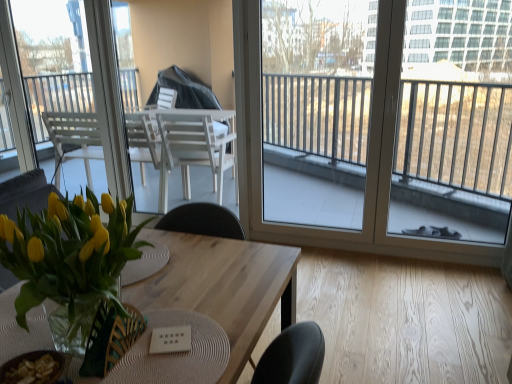
This screenshot has height=384, width=512. What are the coordinates of `translucent glass vase at lower left` in the screenshot? It's located at (72, 264).

The width and height of the screenshot is (512, 384). I want to click on green woven armchair at center, so click(110, 339).

What do you see at coordinates (110, 339) in the screenshot?
I see `green woven armchair at center` at bounding box center [110, 339].

The height and width of the screenshot is (384, 512). Identify the location of transparent glass window at center, which ranks as the first window in front-to-back order. (261, 117).

You are a GUI agent. You are given a task and a screenshot of the screen. Output one action in this format:
    pyautogui.click(x=<x>, y=<y>)
    Task: Click on the translucent glass vase at lower left
    This screenshot has width=512, height=384.
    Given the screenshot: What is the action you would take?
    pyautogui.click(x=72, y=264)

Does point (55, 105) come in front of point (71, 309)?

No, (55, 105) is behind (71, 309).

Is transparent glass window at upper left, marked as the 2th window in a right-to-left arrangement, wider or thinner than translucent glass vase at lower left?

In the image, transparent glass window at upper left, marked as the 2th window in a right-to-left arrangement, appears to be more narrow than translucent glass vase at lower left.

Is transparent glass window at upper left, which is the 1th window from back to front, positioned beyond the bounds of translucent glass vase at lower left?

transparent glass window at upper left, which is the 1th window from back to front, is positioned outside translucent glass vase at lower left.

Can you confirm if transparent glass window at upper left, which is the 1th window from left to right, is positioned to the right of translucent glass vase at lower left?

No.

From a real-world perspective, which object rests below the other?

green woven armchair at center is physically lower.

Consider the image. Is translucent glass vase at lower left next to green woven armchair at center?

No, translucent glass vase at lower left is not beside green woven armchair at center.

Can you confirm if translucent glass vase at lower left is positioned to the right of green woven armchair at center?

In fact, translucent glass vase at lower left is to the left of green woven armchair at center.

Is translucent glass vase at lower left further to the viewer compared to green woven armchair at center?

No, it is in front of green woven armchair at center.

From the picture: Can we say wooden table at center lies outside transparent glass window at upper left, which is the 1th window from back to front?

wooden table at center is positioned outside transparent glass window at upper left, which is the 1th window from back to front.

Considering the sizes of objects wooden table at center and transparent glass window at upper left, which is the 1th window from left to right, in the image provided, who is taller, wooden table at center or transparent glass window at upper left, which is the 1th window from left to right,?

transparent glass window at upper left, which is the 1th window from left to right.

Considering the positions of point (165, 291) and point (16, 4), is point (165, 291) closer or farther from the camera than point (16, 4)?

Clearly, point (165, 291) is closer to the camera than point (16, 4).

Considering the sizes of objects wooden table at center and transparent glass window at upper left, which is the 1th window from back to front, in the image provided, who is bigger, wooden table at center or transparent glass window at upper left, which is the 1th window from back to front,?

wooden table at center is bigger.

In the image, is transparent glass window at center, marked as the first window in a right-to-left arrangement, on the left side or the right side of transparent glass window at upper left, which is the 1th window from left to right?

transparent glass window at center, marked as the first window in a right-to-left arrangement, is to the right of transparent glass window at upper left, which is the 1th window from left to right.

From the picture: Is transparent glass window at center, the 2th window when ordered from left to right, positioned beyond the bounds of transparent glass window at upper left, which is the 1th window from back to front?

Yes, transparent glass window at center, the 2th window when ordered from left to right, is located beyond the bounds of transparent glass window at upper left, which is the 1th window from back to front.

Between transparent glass window at center, which ranks as the first window in front-to-back order, and transparent glass window at upper left, which ranks as the 2th window in front-to-back order, which one has less height?

transparent glass window at upper left, which ranks as the 2th window in front-to-back order.

Who is bigger, green woven armchair at center or wooden table at center?

Bigger between the two is wooden table at center.

Is green woven armchair at center positioned beyond the bounds of wooden table at center?

Absolutely, green woven armchair at center is external to wooden table at center.

Is point (132, 327) closer to camera compared to point (249, 326)?

Yes, point (132, 327) is in front of point (249, 326).

Is transparent glass window at center, which ranks as the first window in front-to-back order, placed right next to green woven armchair at center?

No, transparent glass window at center, which ranks as the first window in front-to-back order, is not with green woven armchair at center.

Is transparent glass window at center, the 2th window when ordered from left to right, taller than green woven armchair at center?

Yes, transparent glass window at center, the 2th window when ordered from left to right, is taller than green woven armchair at center.

How many degrees apart are the facing directions of transparent glass window at center, the 2th window when ordered from left to right, and green woven armchair at center?

transparent glass window at center, the 2th window when ordered from left to right, and green woven armchair at center are facing 90.7 degrees away from each other.

Which of these two, transparent glass window at center, which ranks as the first window in front-to-back order, or green woven armchair at center, is wider?

With larger width is green woven armchair at center.

Which of these two, transparent glass window at upper left, which is the 1th window from left to right, or green woven armchair at center, is thinner?

transparent glass window at upper left, which is the 1th window from left to right.

You are a GUI agent. You are given a task and a screenshot of the screen. Output one action in this format:
    pyautogui.click(x=<x>, y=<y>)
    Task: Click on the window on the left side of green woven armchair at center
    This screenshot has height=384, width=512.
    Given the screenshot: What is the action you would take?
    pyautogui.click(x=53, y=58)

Is transparent glass window at upper left, which ranks as the 2th window in front-to-back order, oriented towards green woven armchair at center?

No, transparent glass window at upper left, which ranks as the 2th window in front-to-back order, is not turned towards green woven armchair at center.

From the image's perspective, is transparent glass window at upper left, which is the 1th window from left to right, on top of green woven armchair at center?

Correct, transparent glass window at upper left, which is the 1th window from left to right, appears higher than green woven armchair at center in the image.

Locate an element on the screen. This screenshot has height=384, width=512. window that appears on the left of translucent glass vase at lower left is located at coordinates (53, 58).

Find the location of a particular element. The width and height of the screenshot is (512, 384). armchair below the translucent glass vase at lower left (from a real-world perspective) is located at coordinates (110, 339).

From the image, which object appears to be nearer to wooden table at center, translucent glass vase at lower left or green woven armchair at center?

translucent glass vase at lower left is closer to wooden table at center.

Which object lies further to the anchor point translucent glass vase at lower left, green woven armchair at center or transparent glass window at upper left, which ranks as the 2th window in front-to-back order?

Based on the image, transparent glass window at upper left, which ranks as the 2th window in front-to-back order, appears to be further to translucent glass vase at lower left.

Which object lies nearer to the anchor point transparent glass window at upper left, which is the 1th window from left to right, wooden table at center or green woven armchair at center?

wooden table at center lies closer to transparent glass window at upper left, which is the 1th window from left to right, than the other object.

Estimate the real-world distances between objects in this image. Which object is further from transparent glass window at center, which is counted as the 2th window, starting from the back, green woven armchair at center or translucent glass vase at lower left?

Among the two, green woven armchair at center is located further to transparent glass window at center, which is counted as the 2th window, starting from the back.

Looking at the image, which one is located further to transparent glass window at center, which is counted as the 2th window, starting from the back, translucent glass vase at lower left or transparent glass window at upper left, which is the 1th window from back to front?

translucent glass vase at lower left lies further to transparent glass window at center, which is counted as the 2th window, starting from the back, than the other object.

Looking at the image, which one is located further to green woven armchair at center, translucent glass vase at lower left or transparent glass window at center, marked as the first window in a right-to-left arrangement?

The object further to green woven armchair at center is transparent glass window at center, marked as the first window in a right-to-left arrangement.

From the image, which object appears to be farther from wooden table at center, green woven armchair at center or transparent glass window at upper left, which is the 1th window from back to front?

Based on the image, transparent glass window at upper left, which is the 1th window from back to front, appears to be further to wooden table at center.

Which object lies nearer to the anchor point transparent glass window at center, marked as the first window in a right-to-left arrangement, green woven armchair at center or wooden table at center?

wooden table at center lies closer to transparent glass window at center, marked as the first window in a right-to-left arrangement, than the other object.

You are a GUI agent. You are given a task and a screenshot of the screen. Output one action in this format:
    pyautogui.click(x=<x>, y=<y>)
    Task: Click on the armchair between wooden table at center and transparent glass window at upper left, which is the 1th window from left to right, in the front-back direction
    
    Given the screenshot: What is the action you would take?
    pyautogui.click(x=110, y=339)

Image resolution: width=512 pixels, height=384 pixels. I want to click on armchair located between wooden table at center and transparent glass window at center, which ranks as the first window in front-to-back order, in the depth direction, so click(110, 339).

The height and width of the screenshot is (384, 512). In order to click on table located between translucent glass vase at lower left and transparent glass window at center, marked as the first window in a right-to-left arrangement, in the depth direction in this screenshot , I will do `click(223, 286)`.

You are a GUI agent. You are given a task and a screenshot of the screen. Output one action in this format:
    pyautogui.click(x=<x>, y=<y>)
    Task: Click on the houseplant situated between transparent glass window at upper left, which ranks as the 2th window in front-to-back order, and transparent glass window at center, which is counted as the 2th window, starting from the back, from left to right
    Image resolution: width=512 pixels, height=384 pixels.
    Given the screenshot: What is the action you would take?
    pyautogui.click(x=72, y=264)